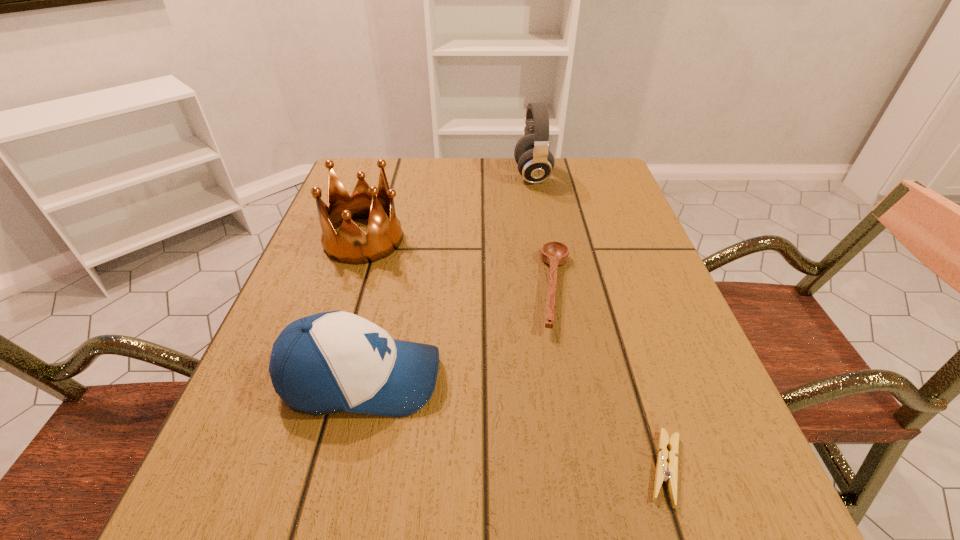
What are the coordinates of `free area in between the fourth shortest object and the rightmost object` in the screenshot? It's located at (515, 354).

Locate an element on the screen. free spot between the fourth tallest object and the baseball cap is located at coordinates (459, 334).

You are a GUI agent. You are given a task and a screenshot of the screen. Output one action in this format:
    pyautogui.click(x=<x>, y=<y>)
    Task: Click on the free spot between the third tallest object and the clothespin
    The width and height of the screenshot is (960, 540).
    Given the screenshot: What is the action you would take?
    pyautogui.click(x=514, y=423)

Find the location of a particular element. free point between the farthest object and the crown is located at coordinates (448, 207).

The image size is (960, 540). What are the coordinates of `vacant region between the nearest object and the fourth farthest object` in the screenshot? It's located at (514, 423).

Where is `blank region between the fourth tallest object and the fourth farthest object`? This screenshot has height=540, width=960. blank region between the fourth tallest object and the fourth farthest object is located at coordinates (459, 334).

Select which object appears as the third closest to the wooden spoon. Please provide its 2D coordinates. Your answer should be formatted as a tuple, i.e. [(x, y)], where the tuple contains the x and y coordinates of a point satisfying the conditions above.

[(535, 162)]

Locate an element on the screen. object that is the third closest to the headset is located at coordinates (331, 362).

This screenshot has width=960, height=540. Identify the location of blank area in the image that satisfies the following two spatial constraints: 1. on the ear cups of the farthest object; 2. on the back side of the nearest object. (585, 468).

Locate an element on the screen. This screenshot has width=960, height=540. free space that satisfies the following two spatial constraints: 1. on the ear cups of the farthest object; 2. on the right side of the wooden spoon is located at coordinates (553, 289).